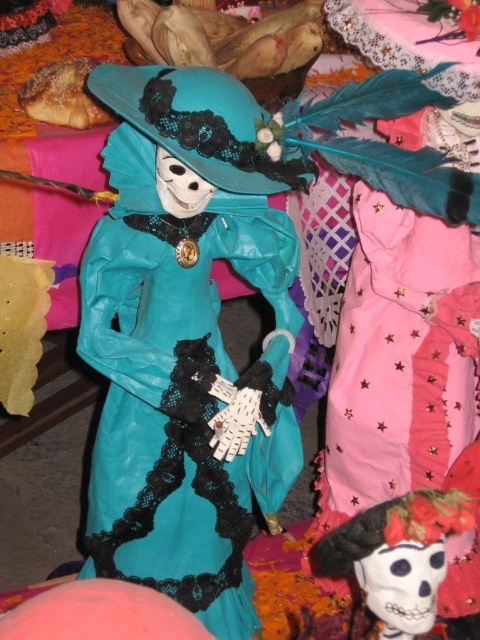
Question: Can you confirm if matte teal dress at center is thinner than matte teal fabric skull at center?

Choices:
 (A) no
 (B) yes

Answer: (A)

Question: In this image, where is matte teal dress at center located relative to matte teal fabric skull at center?

Choices:
 (A) right
 (B) left

Answer: (B)

Question: Which object appears closest to the camera in this image?

Choices:
 (A) matte teal dress at center
 (B) matte teal fabric skull at center

Answer: (B)

Question: Among these points, which one is farthest from the camera?

Choices:
 (A) (219, 115)
 (B) (344, 570)

Answer: (B)

Question: Does matte teal dress at center have a smaller size compared to matte teal fabric skull at center?

Choices:
 (A) no
 (B) yes

Answer: (A)

Question: Which object appears farthest from the camera in this image?

Choices:
 (A) matte teal fabric skull at center
 (B) matte teal dress at center

Answer: (B)